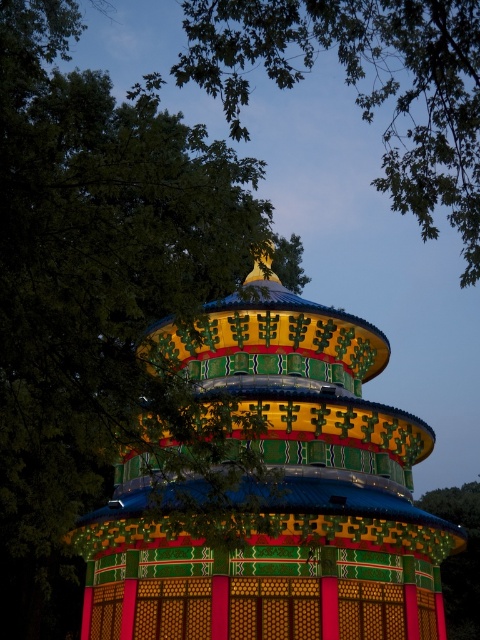
Question: Is multicolored painted pagoda at center below green leafy tree at upper center?

Choices:
 (A) yes
 (B) no

Answer: (A)

Question: Which of these objects is positioned closest to the green leafy tree at upper center?

Choices:
 (A) green textured tree at center
 (B) multicolored painted pagoda at center

Answer: (B)

Question: Can you confirm if multicolored painted pagoda at center is positioned to the left of green textured tree at center?

Choices:
 (A) yes
 (B) no

Answer: (A)

Question: Which point appears farthest from the camera in this image?

Choices:
 (A) (445, 112)
 (B) (460, 588)
 (C) (372, 436)
 (D) (20, 308)

Answer: (B)

Question: Does multicolored painted pagoda at center come in front of green textured tree at center?

Choices:
 (A) yes
 (B) no

Answer: (A)

Question: Which point appears closest to the camera in this image?

Choices:
 (A) (451, 618)
 (B) (362, 477)

Answer: (B)